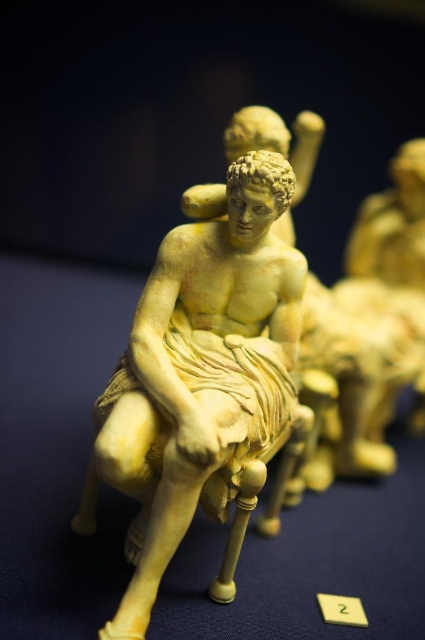
You are an art restorer examining the figurines displayed on the dark blue surface. You notice two points of concern marked at coordinates point (212, 355) and point (345, 609). Which point is closer to you as you examine the figurines?

Point (212, 355) is closer to the camera than point (345, 609).

You are an art curator preparing to display the matte yellow statue at center and the yellow plastic number at center on a narrow shelf. Based on their widths, which object should you place first to ensure both fit on the shelf?

The matte yellow statue at center might be wider than yellow plastic number at center, so it should be placed first to ensure both fit on the shelf.

You are an art curator examining the display of the matte yellow statue at center and the yellow plastic number at center. Which object is taller?

The matte yellow statue at center is taller than the yellow plastic number at center.